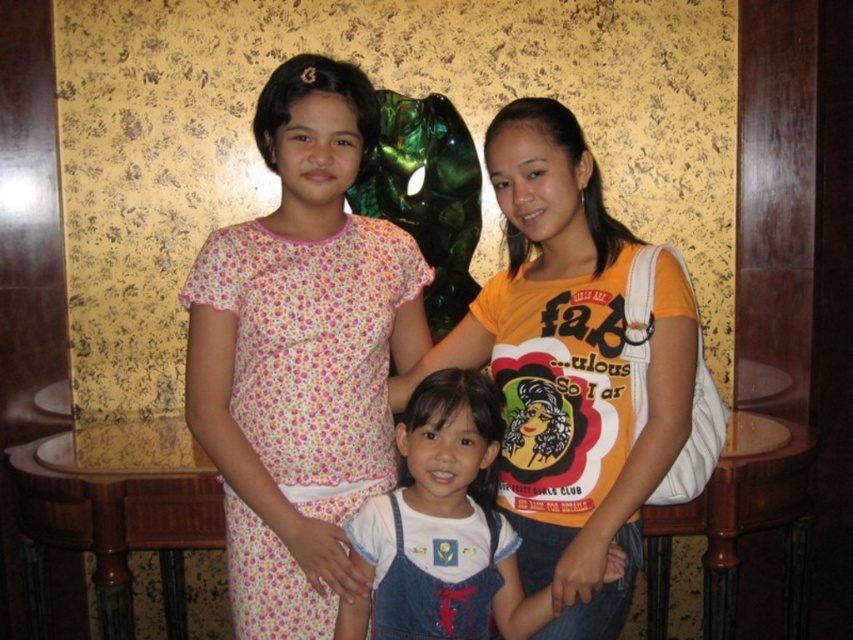
Looking at this image, can you confirm if floral cotton dress at center is smaller than orange cotton t-shirt at center?

Yes.

Is floral cotton dress at center above orange cotton t-shirt at center?

Correct, floral cotton dress at center is located above orange cotton t-shirt at center.

Measure the distance between floral cotton dress at center and camera.

1.62 meters

Identify the location of floral cotton dress at center. This screenshot has height=640, width=853. (300, 353).

Measure the distance between floral cotton dress at center and camera.

floral cotton dress at center and camera are 5.32 feet apart from each other.

Does floral cotton dress at center appear under white denim overalls at center?

No, floral cotton dress at center is not below white denim overalls at center.

I want to click on floral cotton dress at center, so click(x=300, y=353).

Who is higher up, orange cotton t-shirt at center or white denim overalls at center?

orange cotton t-shirt at center is higher up.

Which is in front, point (541, 467) or point (506, 538)?

Point (541, 467)

The image size is (853, 640). Describe the element at coordinates (573, 368) in the screenshot. I see `orange cotton t-shirt at center` at that location.

Image resolution: width=853 pixels, height=640 pixels. I want to click on orange cotton t-shirt at center, so click(573, 368).